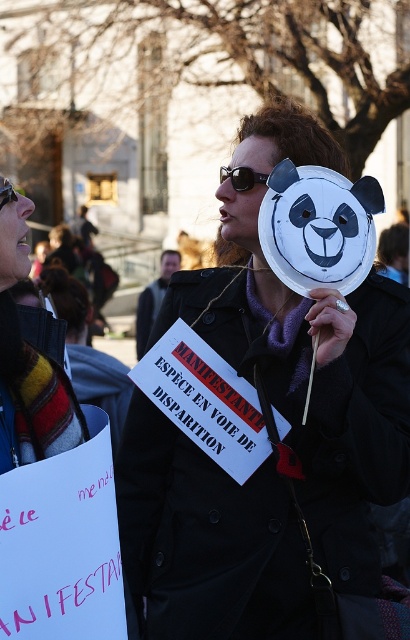
Looking at this image, you are a photographer trying to capture a clear shot of both the smooth skin face at center and the black plastic goggles at upper left. Given that your camera can only focus on objects wider than 10 cm, will both objects be in focus?

The smooth skin face at center is wider than the black plastic goggles at upper left. Since the camera focuses on objects wider than 10 cm, and the smooth skin face at center is larger, it will be in focus. However, the black plastic goggles at upper left might be smaller than 10 cm and thus may not be in focus. Check their actual sizes to confirm.

You are a photographer trying to capture a clear shot of both the matte black coat at center and the matte black sunglasses at upper center. Based on their positions, which object will appear closer to the camera in the photo?

The matte black coat at center appears closer to the camera because it is in front of the matte black sunglasses at upper center.